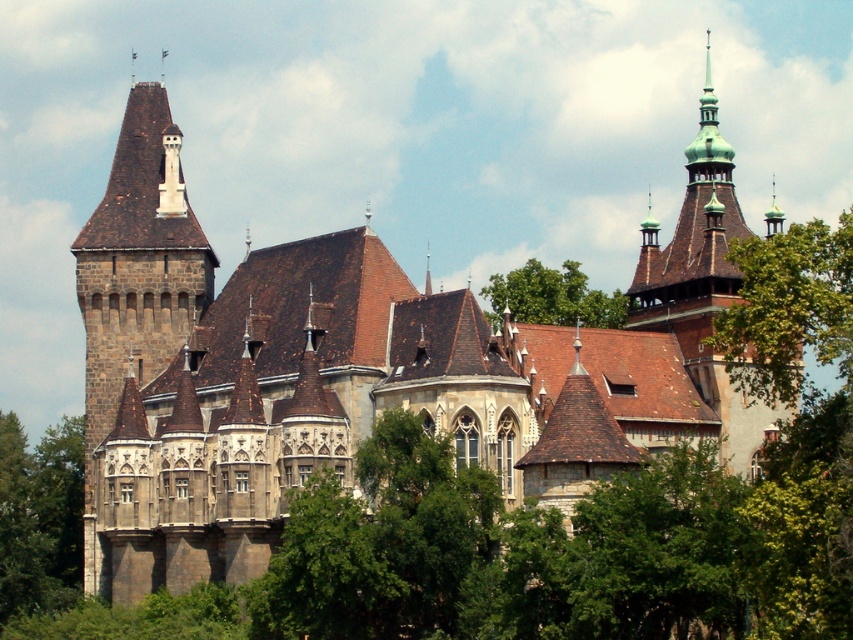
Based on the scene description, where is the green leafy tree at upper right located in terms of coordinates?

The green leafy tree at upper right is located at coordinates point (x=788, y=308).

You are a medieval architect inspecting the castle from a distance. You notice the dark brown stone tower at left and the green copper spire at upper right. Which of these two structures is taller?

The green copper spire at upper right is taller than the dark brown stone tower at left.